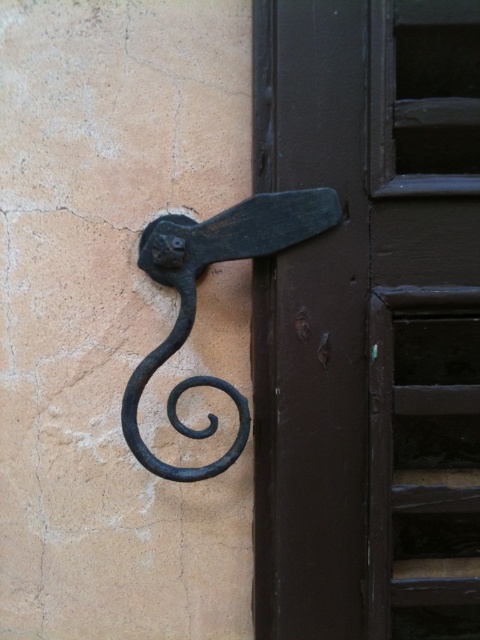
Question: Which point is farther to the camera?

Choices:
 (A) dark brown wood door at center
 (B) black wrought iron door handle at upper center

Answer: (B)

Question: Which point is farther to the camera?

Choices:
 (A) (469, 524)
 (B) (268, 252)

Answer: (A)

Question: Which point is closer to the camera taking this photo?

Choices:
 (A) (279, 420)
 (B) (297, 195)

Answer: (B)

Question: Does dark brown wood door at center come in front of black wrought iron door handle at upper center?

Choices:
 (A) yes
 (B) no

Answer: (A)

Question: Does dark brown wood door at center appear over black wrought iron door handle at upper center?

Choices:
 (A) yes
 (B) no

Answer: (A)

Question: From the image, what is the correct spatial relationship of dark brown wood door at center in relation to black wrought iron door handle at upper center?

Choices:
 (A) above
 (B) below

Answer: (A)